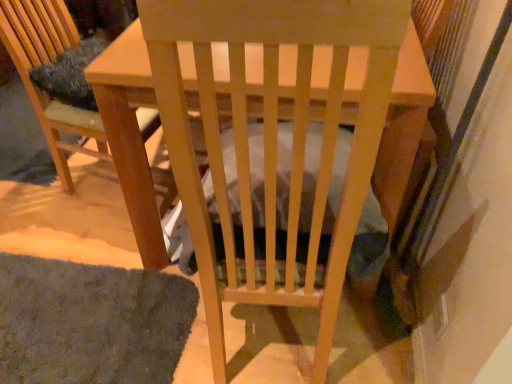
Where is `free space above green shaggy mat at lower left (from a real-world perspective)`? This screenshot has width=512, height=384. free space above green shaggy mat at lower left (from a real-world perspective) is located at coordinates (62, 314).